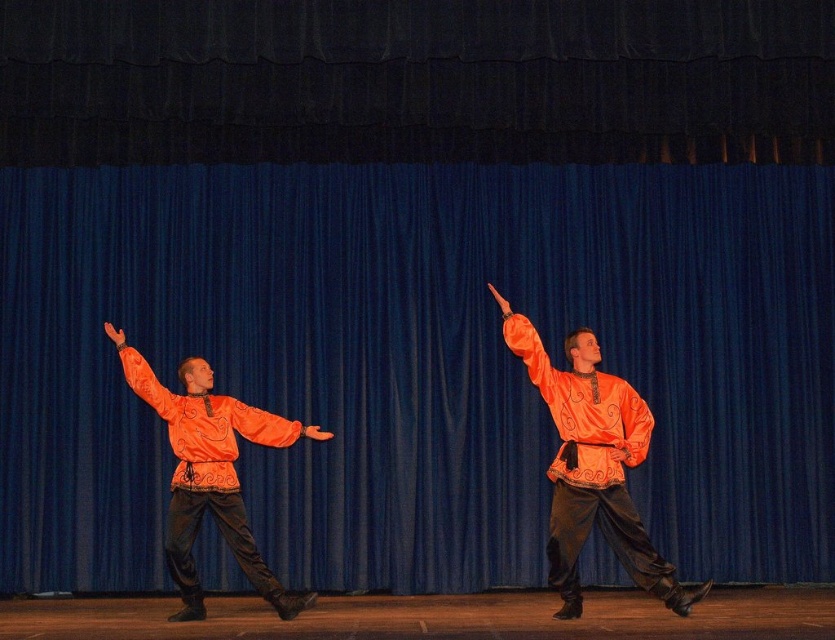
You are a stage designer who needs to adjust the lighting for the performance. The spotlight must be positioned higher for taller items to ensure proper illumination. Which item requires a higher spotlight placement between the orange satin shirt at center and the satin orange robe at left?

The orange satin shirt at center requires a higher spotlight placement because it is much taller than the satin orange robe at left.

Looking at the stage performance, which object is positioned to the right of the other between the orange satin shirt at center and the orange satin hand at center?

The orange satin shirt at center is to the right of the orange satin hand at center.

You are an event organizer planning to display a photo of the two performers on a large screen. The screen has a resolution that can only clearly show objects larger than 10 cm in size. Based on the image description, will both the orange satin shirt at center and the orange satin hand at center be clearly visible on the screen?

The orange satin shirt at center has a larger size compared to orange satin hand at center. Since the screen requires objects to be larger than 10 cm for clear visibility, the orange satin shirt at center will be clearly visible. However, the orange satin hand at center may not meet the size requirement and might appear blurry or indistinct.